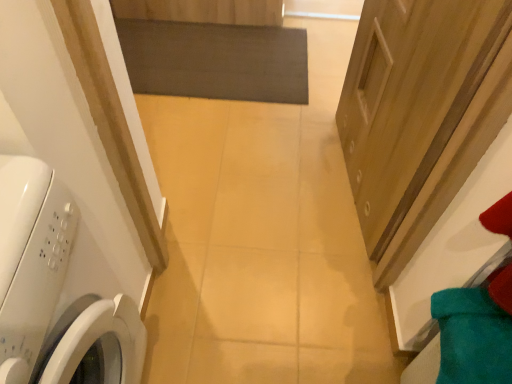
The width and height of the screenshot is (512, 384). What do you see at coordinates (55, 290) in the screenshot? I see `white glossy washing machine at left` at bounding box center [55, 290].

I want to click on white glossy washing machine at left, so click(55, 290).

Is dark gray matte mat at center positioned behind wooden door at right?

Yes, it is.

Is dark gray matte mat at center positioned with its back to wooden door at right?

No, wooden door at right is not at the back of dark gray matte mat at center.

Considering the sizes of objects dark gray matte mat at center and wooden door at right in the image provided, who is shorter, dark gray matte mat at center or wooden door at right?

With less height is dark gray matte mat at center.

From the image's perspective, is dark gray matte mat at center above wooden door at right?

Indeed, from the image's perspective, dark gray matte mat at center is shown above wooden door at right.

From the image's perspective, would you say white glossy washing machine at left is shown under wooden door at right?

Yes, from the image's perspective, white glossy washing machine at left is beneath wooden door at right.

Is wooden door at right at the back of white glossy washing machine at left?

No, white glossy washing machine at left's orientation is not away from wooden door at right.

Between white glossy washing machine at left and wooden door at right, which one has larger size?

With larger size is white glossy washing machine at left.

Is white glossy washing machine at left at the right side of wooden door at right?

Incorrect, white glossy washing machine at left is not on the right side of wooden door at right.

Can you tell me how much wooden door at right and white glossy washing machine at left differ in facing direction?

172 degrees separate the facing orientations of wooden door at right and white glossy washing machine at left.

Which object is further away from the camera, wooden door at right or white glossy washing machine at left?

wooden door at right is further away from the camera.

Considering the relative positions of wooden door at right and white glossy washing machine at left in the image provided, is wooden door at right to the left or to the right of white glossy washing machine at left?

From the image, it's evident that wooden door at right is to the right of white glossy washing machine at left.

Which object is wider, wooden door at right or white glossy washing machine at left?

Wider between the two is white glossy washing machine at left.

Based on the photo, is wooden door at right positioned with its back to dark gray matte mat at center?

No.

Based on the photo, is wooden door at right situated inside dark gray matte mat at center or outside?

The correct answer is: outside.

Where is `mat that appears behind the wooden door at right`? mat that appears behind the wooden door at right is located at coordinates (215, 60).

Considering the sizes of objects white glossy washing machine at left and dark gray matte mat at center in the image provided, who is shorter, white glossy washing machine at left or dark gray matte mat at center?

dark gray matte mat at center.

Based on the photo, from the image's perspective, who appears lower, white glossy washing machine at left or dark gray matte mat at center?

white glossy washing machine at left.

Is point (262, 35) farther from camera compared to point (66, 241)?

Yes, it is.

Can you confirm if dark gray matte mat at center is wider than white glossy washing machine at left?

Yes, dark gray matte mat at center is wider than white glossy washing machine at left.

Which is more to the right, dark gray matte mat at center or white glossy washing machine at left?

Positioned to the right is dark gray matte mat at center.

From the image's perspective, is dark gray matte mat at center above white glossy washing machine at left?

Yes, from the image's perspective, dark gray matte mat at center is on top of white glossy washing machine at left.

Where is `door located below the dark gray matte mat at center (from the image's perspective)`? door located below the dark gray matte mat at center (from the image's perspective) is located at coordinates (410, 97).

Where is `washing machine above the wooden door at right (from a real-world perspective)`? washing machine above the wooden door at right (from a real-world perspective) is located at coordinates (55, 290).

Which object lies nearer to the anchor point wooden door at right, white glossy washing machine at left or dark gray matte mat at center?

dark gray matte mat at center is positioned closer to the anchor wooden door at right.

Based on their spatial positions, is white glossy washing machine at left or wooden door at right closer to dark gray matte mat at center?

The object closer to dark gray matte mat at center is wooden door at right.

Based on the photo, considering their positions, is dark gray matte mat at center positioned closer to white glossy washing machine at left than wooden door at right?

Based on the image, wooden door at right appears to be nearer to white glossy washing machine at left.

Looking at the image, which one is located closer to white glossy washing machine at left, wooden door at right or dark gray matte mat at center?

wooden door at right is closer to white glossy washing machine at left.

Estimate the real-world distances between objects in this image. Which object is closer to wooden door at right, dark gray matte mat at center or white glossy washing machine at left?

dark gray matte mat at center.

When comparing their distances from dark gray matte mat at center, does wooden door at right or white glossy washing machine at left seem closer?

wooden door at right.

Find the location of `door between white glossy washing machine at left and dark gray matte mat at center along the z-axis`. door between white glossy washing machine at left and dark gray matte mat at center along the z-axis is located at coordinates (410, 97).